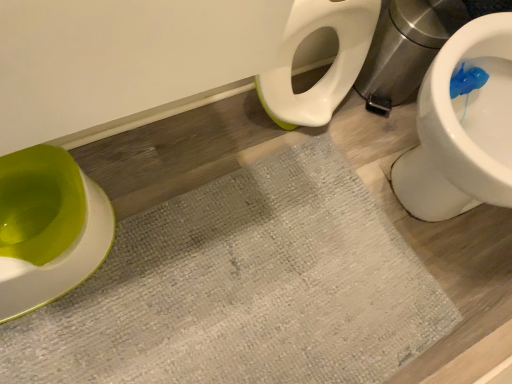
Question: In terms of height, does textured gray bath mat at center look taller or shorter compared to green plastic toilet at left?

Choices:
 (A) short
 (B) tall

Answer: (A)

Question: Based on their positions, is textured gray bath mat at center located to the left or right of green plastic toilet at left?

Choices:
 (A) right
 (B) left

Answer: (A)

Question: Is textured gray bath mat at center wider or thinner than green plastic toilet at left?

Choices:
 (A) thin
 (B) wide

Answer: (B)

Question: In terms of height, does green plastic toilet at left look taller or shorter compared to textured gray bath mat at center?

Choices:
 (A) short
 (B) tall

Answer: (B)

Question: Would you say green plastic toilet at left is to the left or to the right of textured gray bath mat at center in the picture?

Choices:
 (A) left
 (B) right

Answer: (A)

Question: Is green plastic toilet at left inside the boundaries of textured gray bath mat at center, or outside?

Choices:
 (A) inside
 (B) outside

Answer: (B)

Question: Considering the positions of green plastic toilet at left and textured gray bath mat at center in the image, is green plastic toilet at left bigger or smaller than textured gray bath mat at center?

Choices:
 (A) small
 (B) big

Answer: (A)